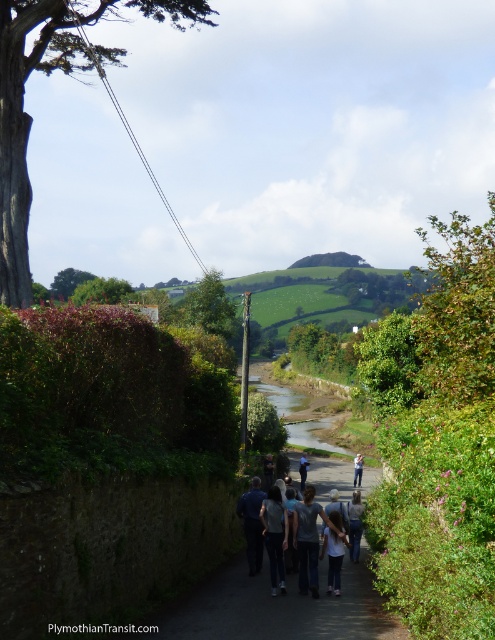
You are standing at the starting point of the pathway and notice a person wearing a dark gray shirt at center. If you want to reach them quickly, should you walk along the left side of the path or the right side?

The dark gray shirt at center is located at point (314, 540), so you should walk along the right side of the path to reach them quickly since the person is positioned more towards the right side of the path.

You are standing at the starting point of the pathway and want to take a photo of the dark gray shirt at center. Which direction should you face to ensure the shirt is in the frame?

The dark gray shirt at center is located at point (314, 540), so you should face towards the center of the image to capture it in your photo.